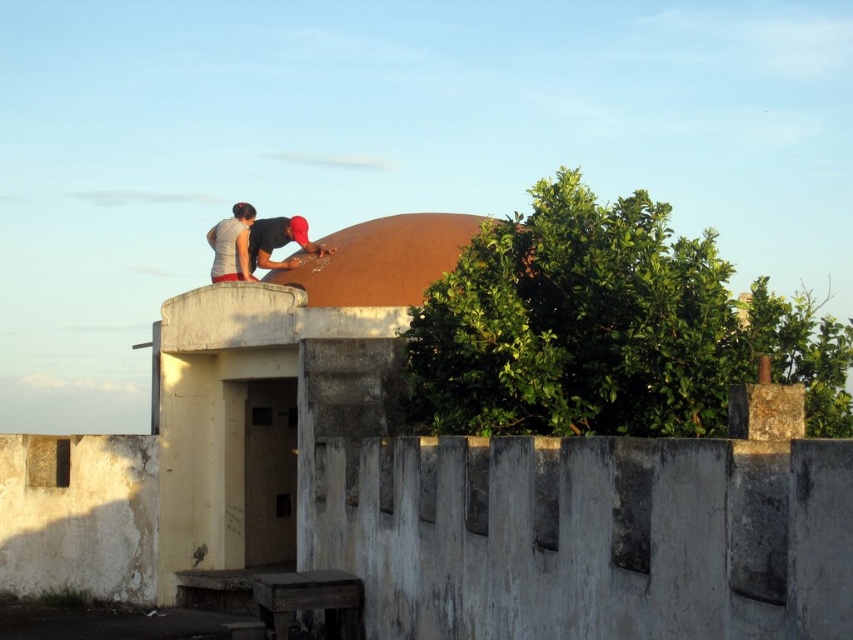
Can you confirm if matte gray shirt at upper center is smaller than matte black shirt at upper center?

No.

Who is taller, matte gray shirt at upper center or matte black shirt at upper center?

Standing taller between the two is matte gray shirt at upper center.

What do you see at coordinates (231, 244) in the screenshot?
I see `matte gray shirt at upper center` at bounding box center [231, 244].

Find the location of `matte gray shirt at upper center`. matte gray shirt at upper center is located at coordinates (231, 244).

What do you see at coordinates (381, 260) in the screenshot? I see `brown matte dome at center` at bounding box center [381, 260].

At what (x,y) coordinates should I click in order to perform the action: click on brown matte dome at center. Please return your answer as a coordinate pair (x, y). The height and width of the screenshot is (640, 853). Looking at the image, I should click on (381, 260).

Which is more to the right, brown matte dome at center or matte black shirt at upper center?

Positioned to the right is brown matte dome at center.

Is point (363, 243) positioned in front of point (259, 237)?

Yes, it is.

Which is in front, point (405, 225) or point (300, 236)?

Point (405, 225)

Where is `brown matte dome at center`? brown matte dome at center is located at coordinates (381, 260).